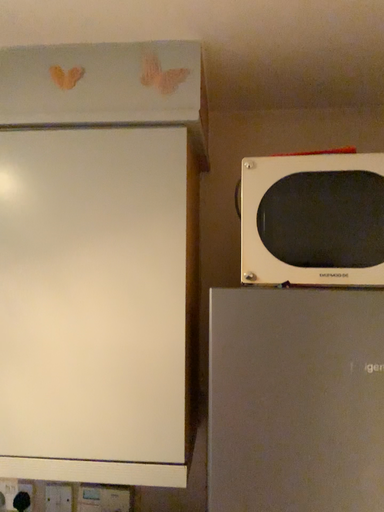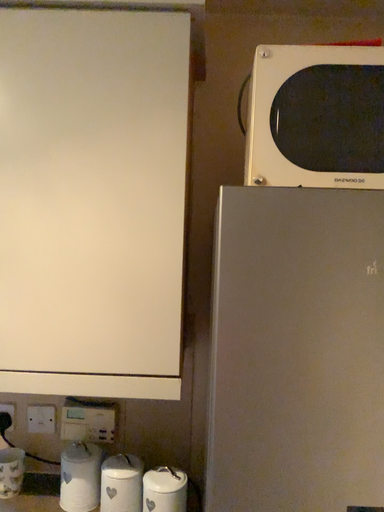
Question: Which way did the camera rotate in the video?

Choices:
 (A) rotated upward
 (B) rotated downward

Answer: (B)